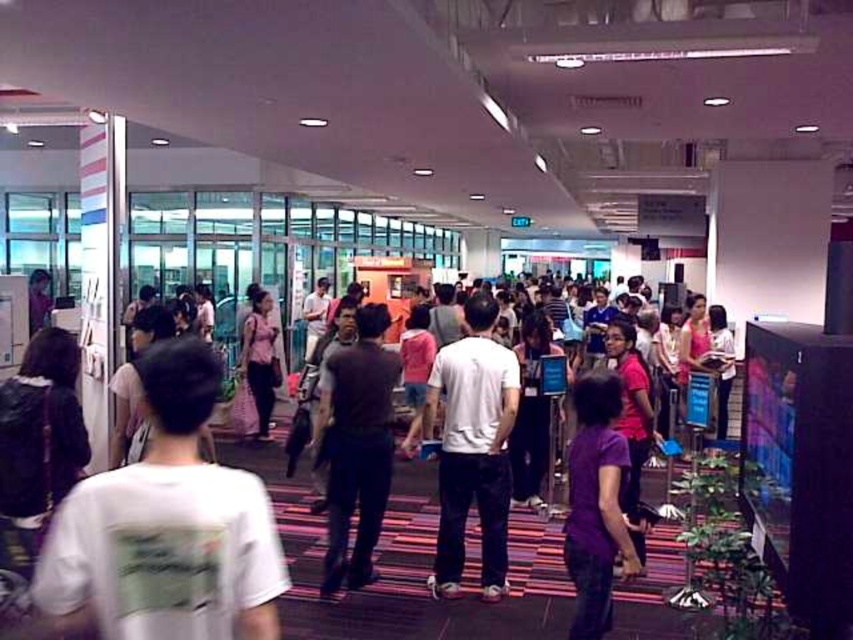
Measure the distance between white matte shirt at center and pink fabric dress at center.

The distance of white matte shirt at center from pink fabric dress at center is 13.52 feet.

Between white matte shirt at center and pink fabric dress at center, which one is positioned higher?

pink fabric dress at center is higher up.

Locate an element on the screen. The image size is (853, 640). white matte shirt at center is located at coordinates (473, 445).

Is white matte shirt at center bigger than purple matte shirt at center?

Indeed, white matte shirt at center has a larger size compared to purple matte shirt at center.

Does white matte shirt at center appear over purple matte shirt at center?

Correct, white matte shirt at center is located above purple matte shirt at center.

Identify the location of white matte shirt at center. This screenshot has height=640, width=853. (473, 445).

Find the location of a particular element. white matte shirt at center is located at coordinates (473, 445).

Is point (248, 531) closer to camera compared to point (252, 308)?

Yes, point (248, 531) is in front of point (252, 308).

This screenshot has width=853, height=640. What do you see at coordinates (165, 529) in the screenshot?
I see `white cotton t-shirt at center` at bounding box center [165, 529].

Locate an element on the screen. white cotton t-shirt at center is located at coordinates (165, 529).